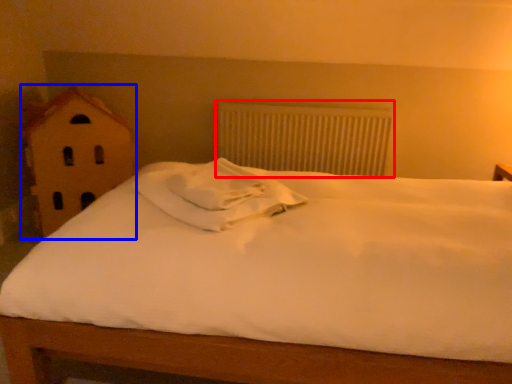
Question: Which point is closer to the camera, radiator (highlighted by a red box) or toy (highlighted by a blue box)?

Choices:
 (A) radiator
 (B) toy

Answer: (B)